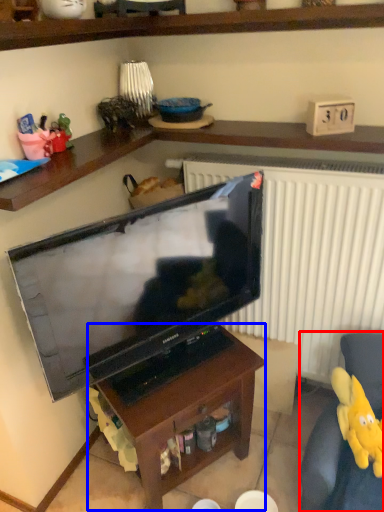
Question: Among these objects, which one is nearest to the camera, swivel chair (highlighted by a red box) or table (highlighted by a blue box)?

Choices:
 (A) swivel chair
 (B) table

Answer: (A)